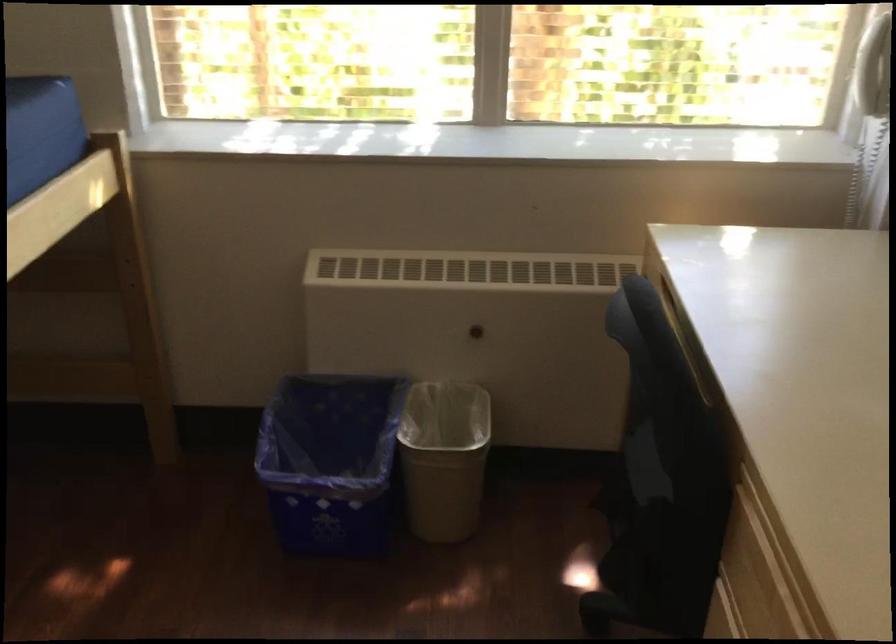
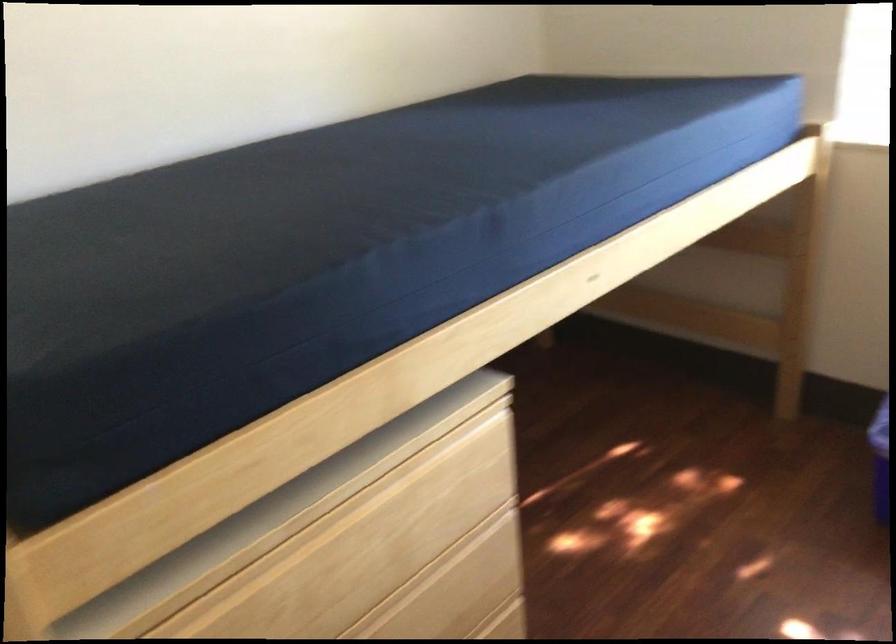
The point at (151, 313) is marked in the first image. Where is the corresponding point in the second image?

(803, 275)